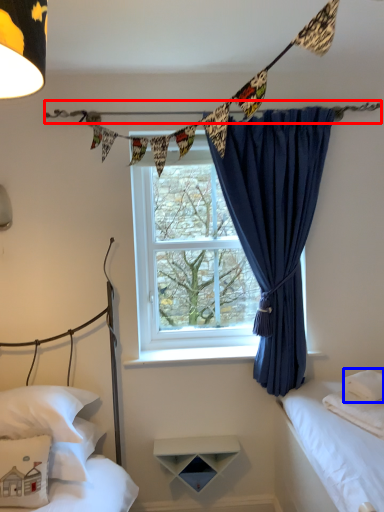
Question: Which of the following is the closest to the observer, clothesline (highlighted by a red box) or pillow (highlighted by a blue box)?

Choices:
 (A) clothesline
 (B) pillow

Answer: (B)